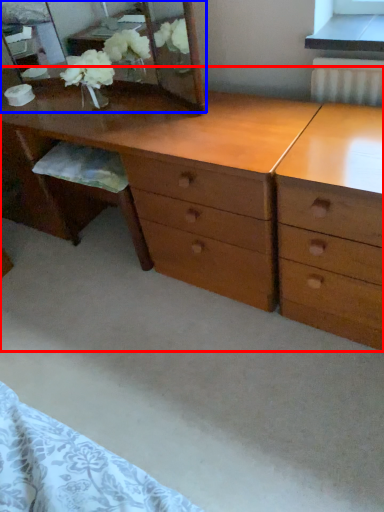
Question: Which object appears closest to the camera in this image, desk (highlighted by a red box) or mirror (highlighted by a blue box)?

Choices:
 (A) desk
 (B) mirror

Answer: (A)